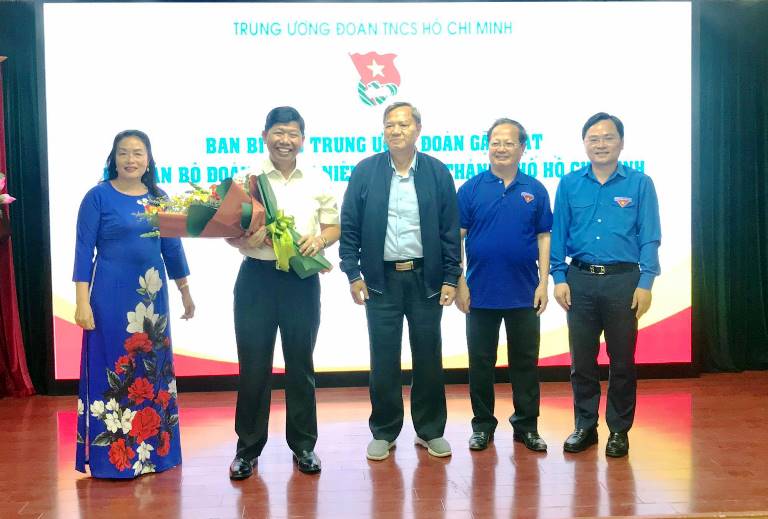
What are the coordinates of `black curtains` in the screenshot? It's located at click(733, 167), click(20, 151).